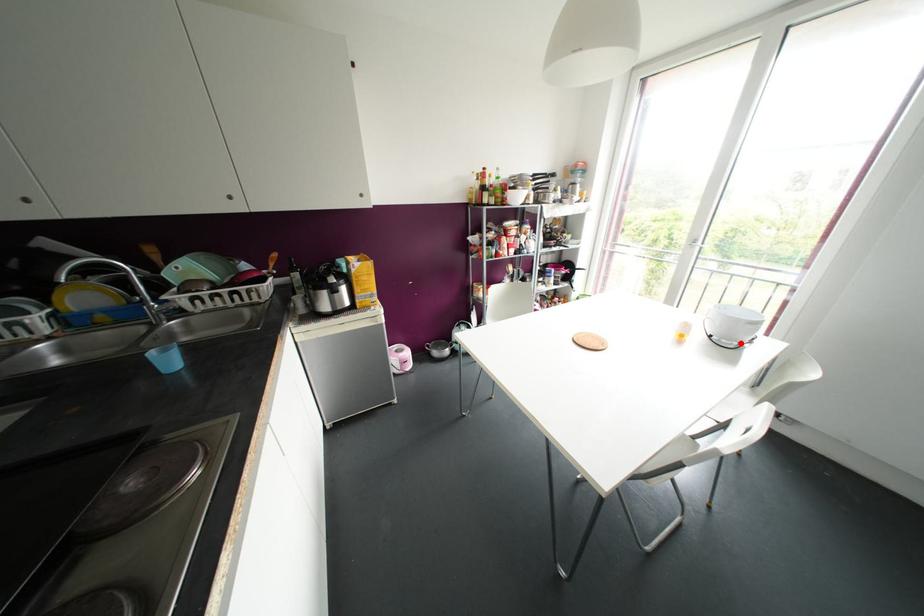
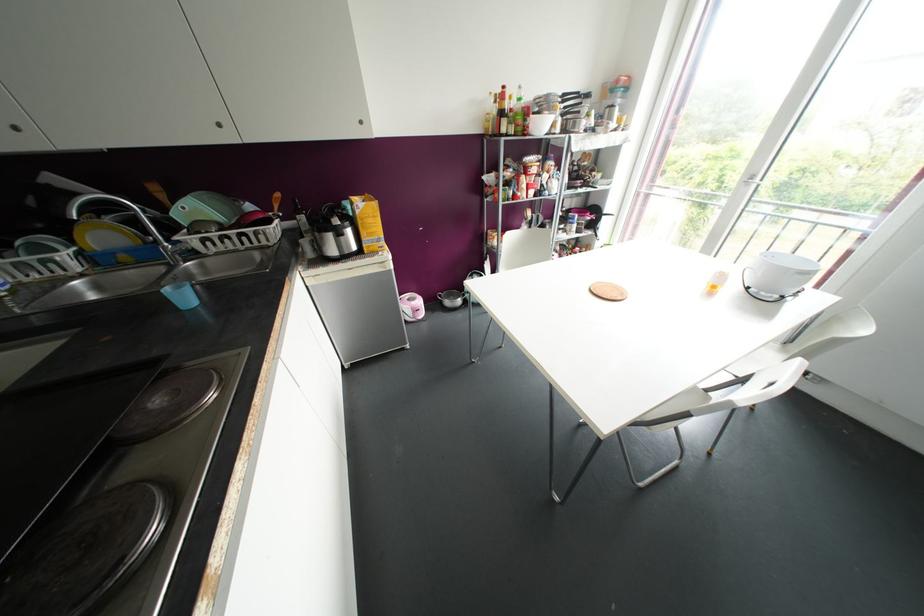
Locate, in the second image, the point that corresponds to the highlighted location in the first image.

(782, 297)